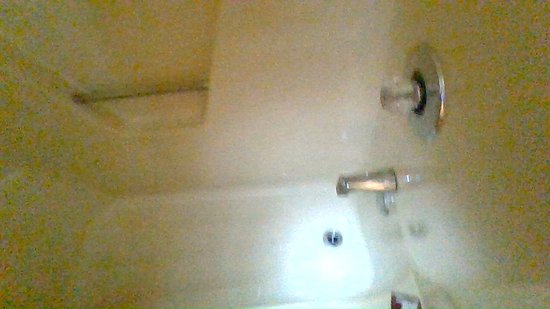
The height and width of the screenshot is (309, 550). I want to click on clear knob, so click(x=394, y=92).